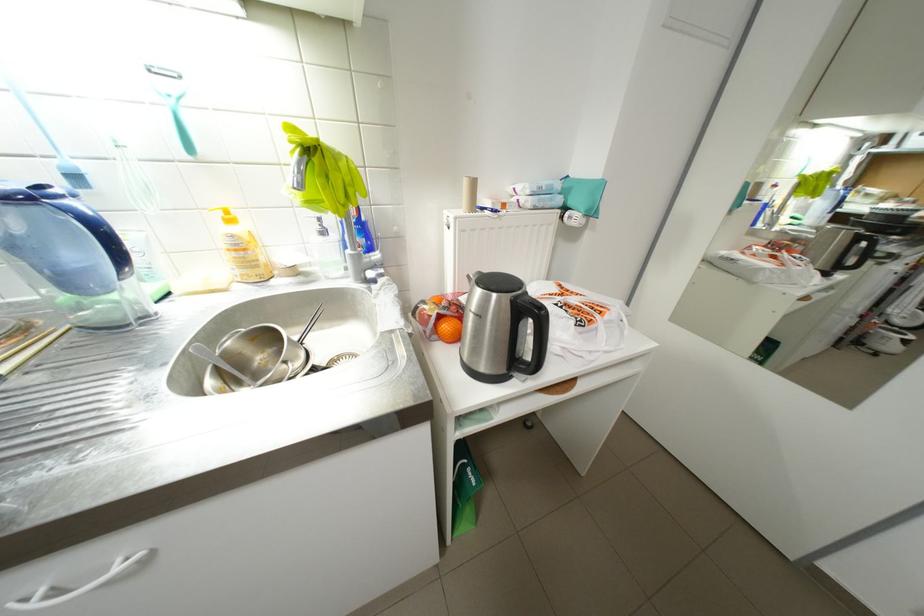
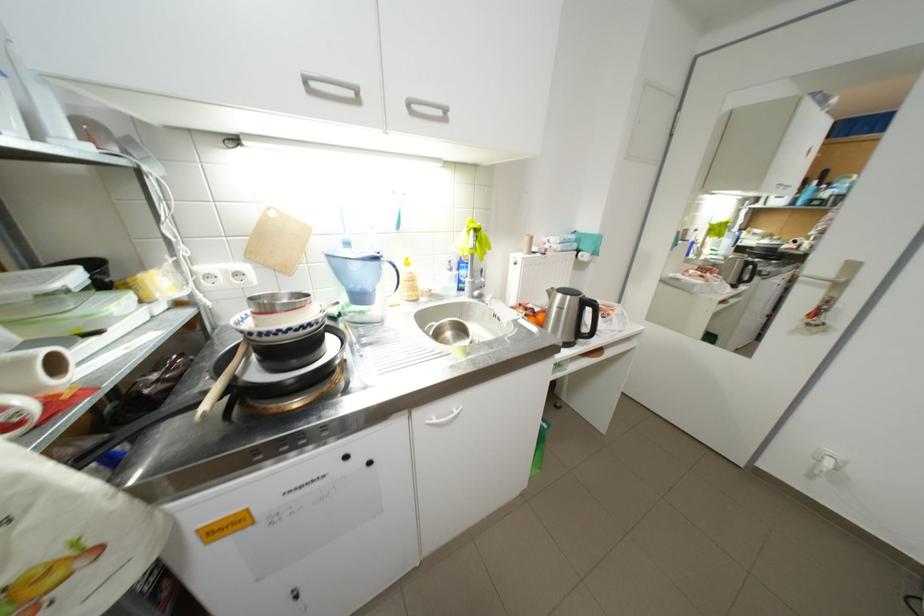
Find the pixel in the second image that matches (x=43, y=200) in the first image.

(387, 259)